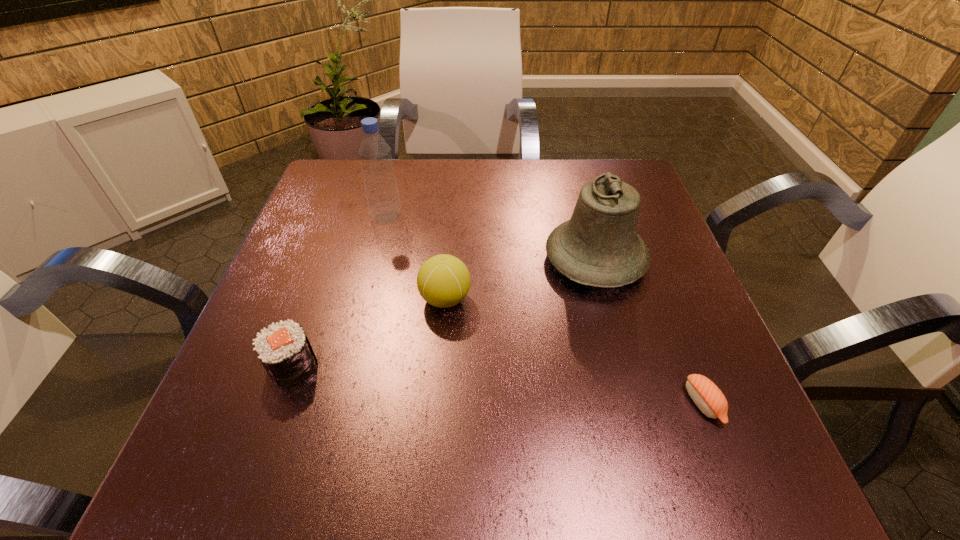
In the image, there is a desktop. At what (x,y) coordinates should I click in order to perform the action: click on blank space at the far edge. Please return your answer as a coordinate pair (x, y). The height and width of the screenshot is (540, 960). Looking at the image, I should click on (559, 158).

Locate an element on the screen. free spot at the near edge of the desktop is located at coordinates (548, 434).

Find the location of `vacant area at the left edge of the desktop`. vacant area at the left edge of the desktop is located at coordinates (290, 406).

Locate an element on the screen. The width and height of the screenshot is (960, 540). free spot at the right edge of the desktop is located at coordinates (674, 406).

At what (x,y) coordinates should I click in order to perform the action: click on free location at the far left corner of the desktop. Please return your answer as a coordinate pair (x, y). The width and height of the screenshot is (960, 540). Looking at the image, I should click on (355, 163).

Locate an element on the screen. vacant space at the near left corner is located at coordinates (258, 474).

Identify the location of vacant area at the near right corner of the desktop. (728, 494).

I want to click on unoccupied area between the bottle and the bell, so click(x=491, y=239).

You are a GUI agent. You are given a task and a screenshot of the screen. Output one action in this format:
    pyautogui.click(x=<x>, y=<y>)
    Task: Click on the free space between the bell and the farthest object
    The width and height of the screenshot is (960, 540).
    Given the screenshot: What is the action you would take?
    pyautogui.click(x=491, y=239)

I want to click on free space between the second shortest object and the fourth shortest object, so click(x=444, y=313).